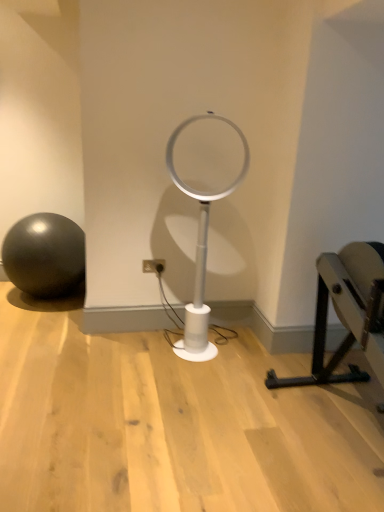
Identify the location of free spot below white plastic table lamp at center (from a real-world perspective). (217, 350).